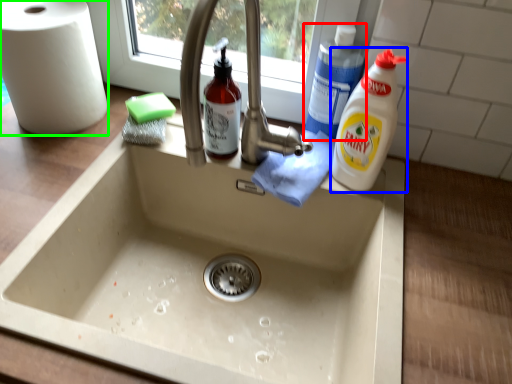
Question: Which object is the farthest from cleaning product (highlighted by a red box)? Choose among these: cleaning product (highlighted by a blue box) or paper towel (highlighted by a green box).

Choices:
 (A) cleaning product
 (B) paper towel

Answer: (B)